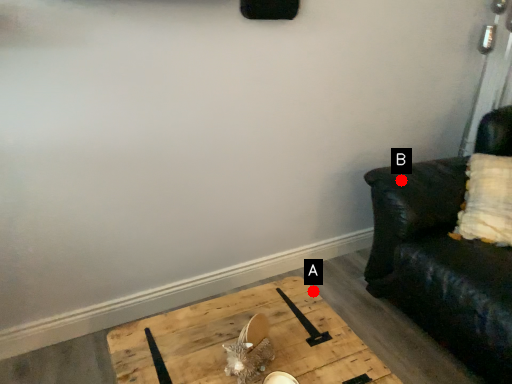
Question: Two points are circled on the image, labeled by A and B beside each circle. Which point is farther to the camera?

Choices:
 (A) A is further
 (B) B is further

Answer: (B)